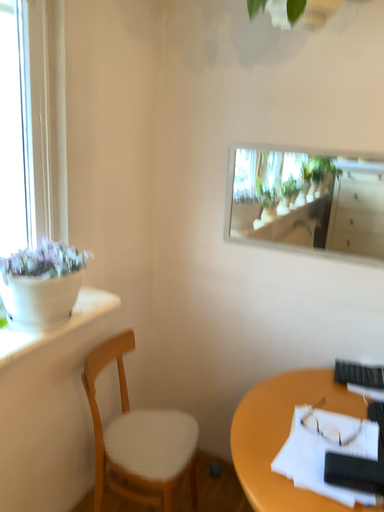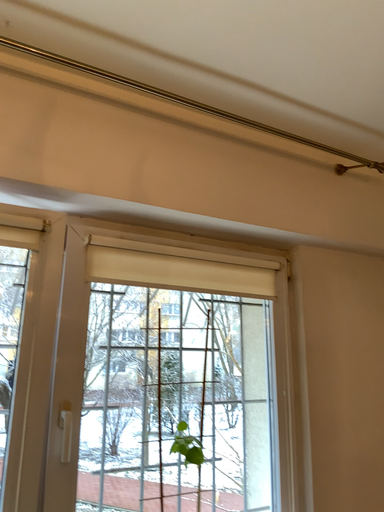
Question: Which way did the camera rotate in the video?

Choices:
 (A) rotated left
 (B) rotated right

Answer: (A)